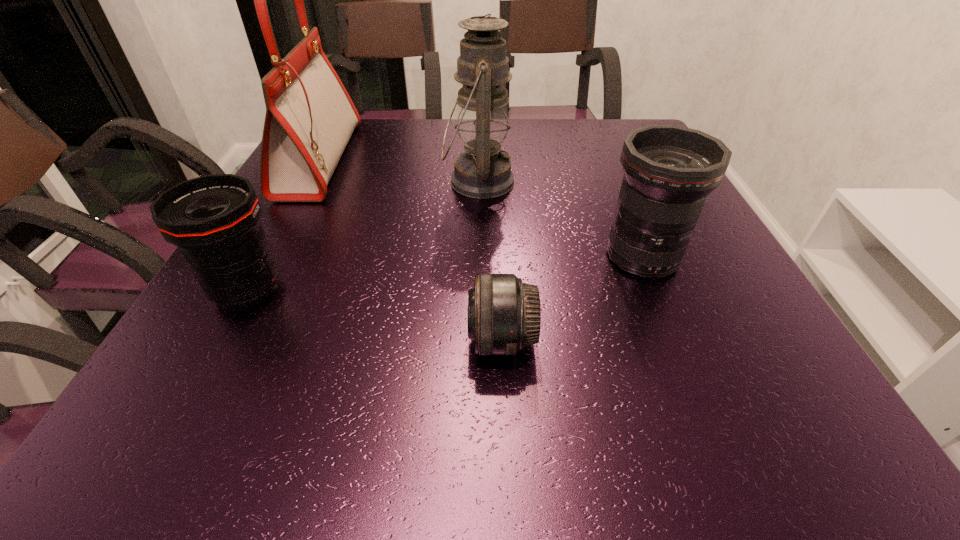
Locate an element on the screen. The height and width of the screenshot is (540, 960). object at the far left corner is located at coordinates (310, 117).

Locate an element on the screen. The height and width of the screenshot is (540, 960). free space at the far edge is located at coordinates point(576,123).

This screenshot has height=540, width=960. In the image, there is a desktop. What are the coordinates of `vacant space at the left edge` in the screenshot? It's located at (289, 224).

Find the location of a particular element. This screenshot has width=960, height=540. free spot at the right edge of the desktop is located at coordinates (705, 221).

The height and width of the screenshot is (540, 960). Find the location of `blank space at the near left corner`. blank space at the near left corner is located at coordinates (192, 446).

This screenshot has width=960, height=540. In order to click on free region at the far right corner of the desktop in this screenshot , I will do [595, 131].

You are a GUI agent. You are given a task and a screenshot of the screen. Output one action in this format:
    pyautogui.click(x=<x>, y=<y>)
    Task: Click on the free area in between the second shortest object and the shortest object
    The height and width of the screenshot is (540, 960).
    Given the screenshot: What is the action you would take?
    pyautogui.click(x=374, y=315)

Where is `vacant space that is in between the shortest telephoto lens and the second tallest object`? The image size is (960, 540). vacant space that is in between the shortest telephoto lens and the second tallest object is located at coordinates (490, 261).

Locate an element on the screen. This screenshot has width=960, height=540. vacant area between the second tallest telephoto lens and the shortest object is located at coordinates (374, 315).

Locate an element on the screen. empty space between the tallest object and the second tallest telephoto lens is located at coordinates (284, 225).